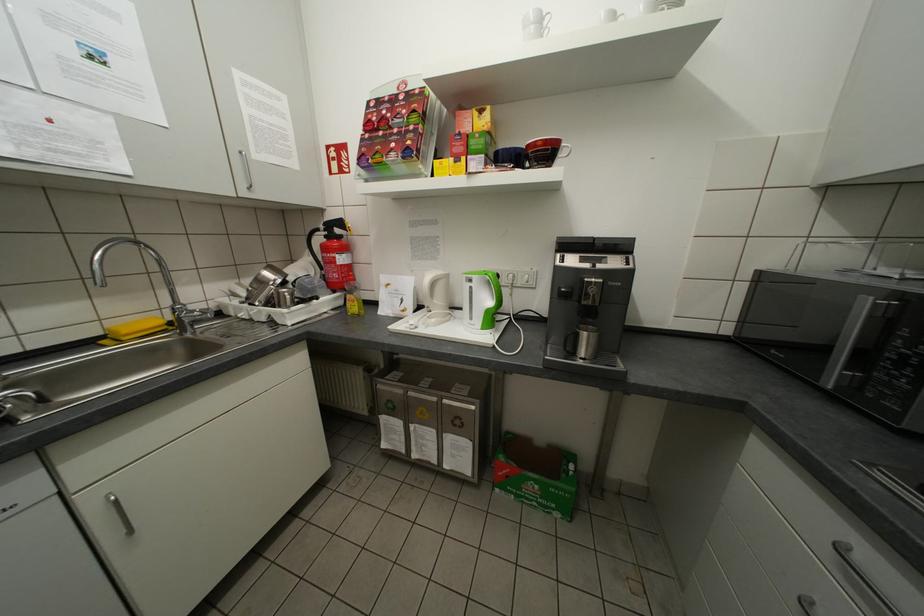
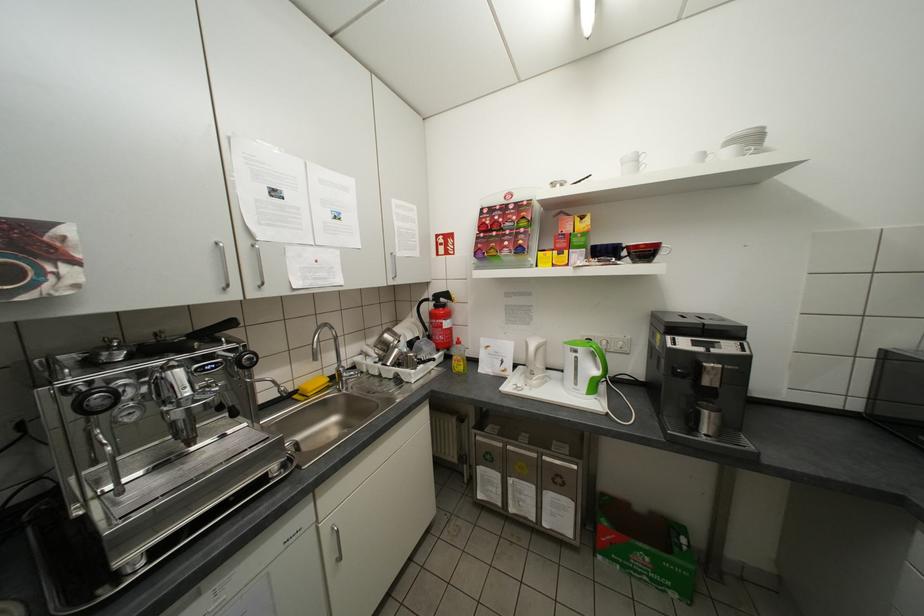
Locate, in the second image, the point that corresponds to pixel 574 468 in the first image.

(685, 541)